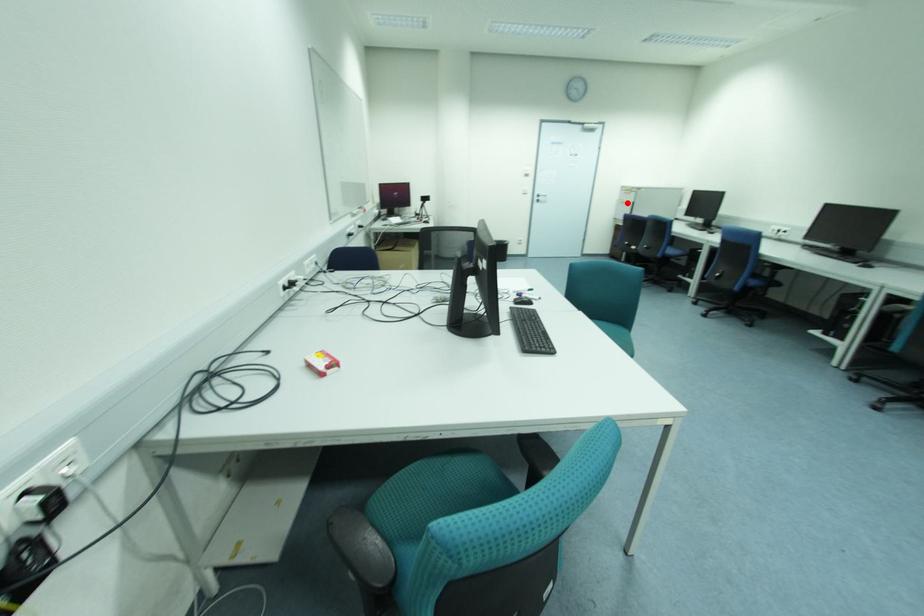
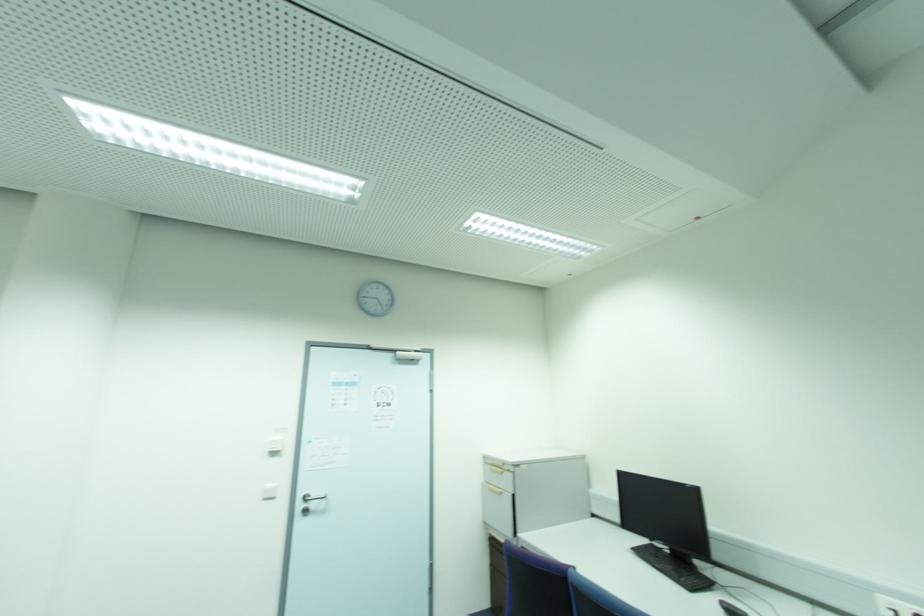
Find the pixel in the second image that matches the highlighted location in the first image.

(502, 493)